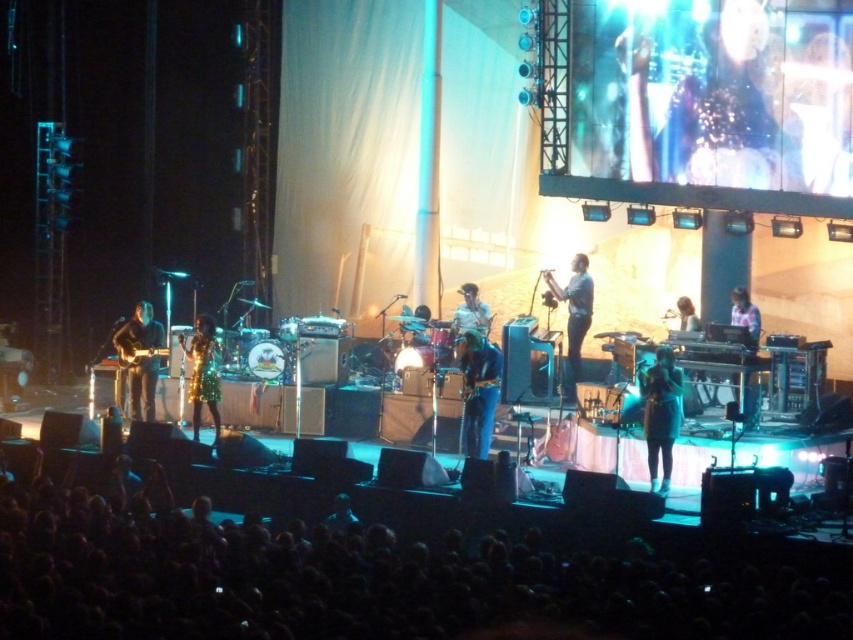
Question: Is matte brown guitar at left thinner than shiny metallic guitar at left?

Choices:
 (A) no
 (B) yes

Answer: (A)

Question: Which of the following is the closest to the observer?

Choices:
 (A) (698, 317)
 (B) (656, 440)
 (C) (200, 358)

Answer: (B)

Question: Is the position of matte brown guitar at left less distant than that of shiny silver drum at center?

Choices:
 (A) yes
 (B) no

Answer: (A)

Question: Is shiny silver drum at center positioned at the back of shiny silver microphone at center?

Choices:
 (A) yes
 (B) no

Answer: (A)

Question: Among these objects, which one is farthest from the camera?

Choices:
 (A) plaid shirt at center
 (B) shiny metallic dress at center
 (C) light blue denim shirt at center
 (D) shiny blue shirt at center

Answer: (D)

Question: Which object is closer to the camera taking this photo?

Choices:
 (A) shiny blue shirt at center
 (B) shiny silver microphone at center

Answer: (B)